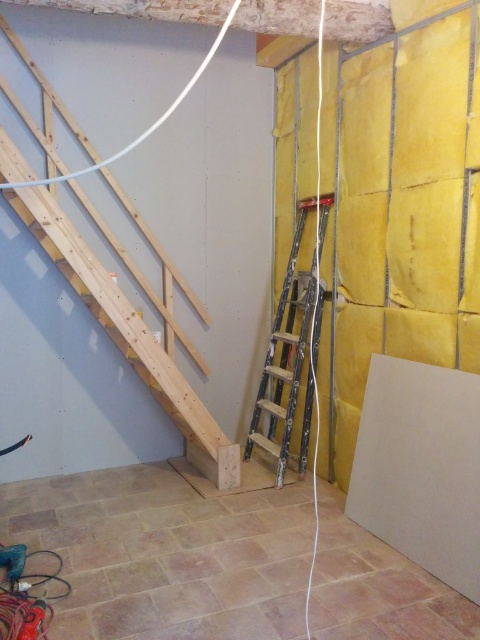
Question: Based on their relative distances, which object is nearer to the natural wood stairs at left?

Choices:
 (A) metallic silver ladder at center
 (B) beige tile floor at lower center

Answer: (A)

Question: Which point is farther to the camera?

Choices:
 (A) metallic silver ladder at center
 (B) beige tile floor at lower center

Answer: (A)

Question: Is beige tile floor at lower center further to the viewer compared to metallic silver ladder at center?

Choices:
 (A) yes
 (B) no

Answer: (B)

Question: Can you confirm if beige tile floor at lower center is wider than metallic silver ladder at center?

Choices:
 (A) yes
 (B) no

Answer: (A)

Question: In this image, where is beige tile floor at lower center located relative to metallic silver ladder at center?

Choices:
 (A) right
 (B) left

Answer: (B)

Question: Estimate the real-world distances between objects in this image. Which object is closer to the natural wood stairs at left?

Choices:
 (A) metallic silver ladder at center
 (B) beige tile floor at lower center

Answer: (A)